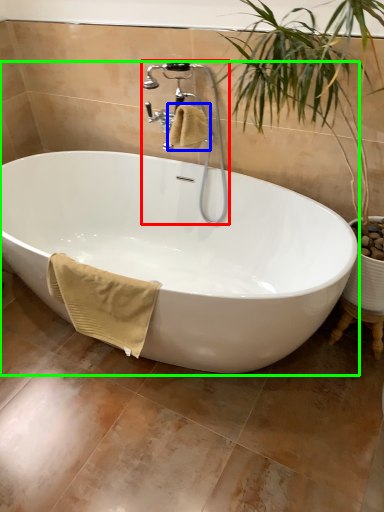
Question: Estimate the real-world distances between objects in this image. Which object is farther from faucet (highlighted by a red box), bath towel (highlighted by a blue box) or bathtub (highlighted by a green box)?

Choices:
 (A) bath towel
 (B) bathtub

Answer: (B)